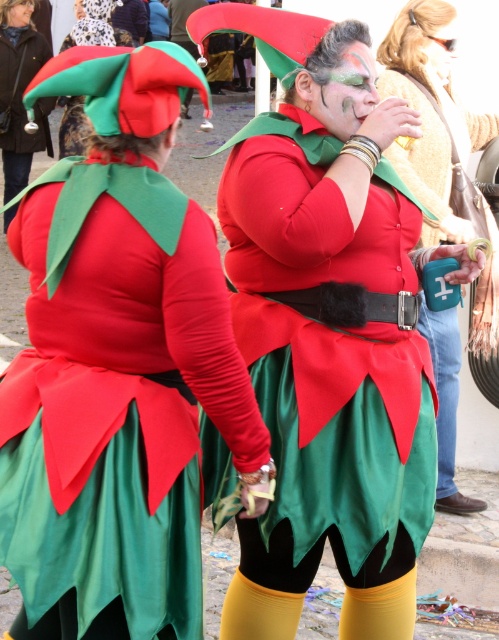
Question: Is the position of matte plastic cup at center more distant than that of green satin skirt at lower center?

Choices:
 (A) no
 (B) yes

Answer: (B)

Question: Observing the image, what is the correct spatial positioning of matte red costume at center in reference to matte green fabric hat at upper center?

Choices:
 (A) left
 (B) right

Answer: (B)

Question: Which point is closer to the camera taking this photo?

Choices:
 (A) (446, 26)
 (B) (357, 90)
 (C) (384, 552)
 (D) (40, 120)

Answer: (B)

Question: Which point is closer to the camera?

Choices:
 (A) (413, 621)
 (B) (356, 116)
 (C) (138, 35)
 (D) (418, 328)

Answer: (B)

Question: Can you confirm if matte green fabric hat at upper left is smaller than matte green face at upper center?

Choices:
 (A) no
 (B) yes

Answer: (A)

Question: Among these points, which one is nearest to the camera?

Choices:
 (A) (457, 374)
 (B) (18, 38)
 (C) (338, 129)
 (D) (190, 3)

Answer: (C)